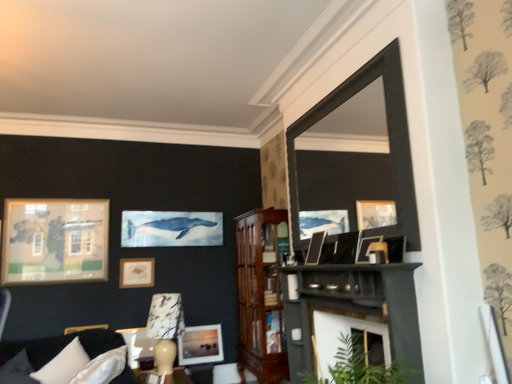
Locate an element on the screen. The height and width of the screenshot is (384, 512). matte black picture frame at center, positioned as the second picture frame in right-to-left order is located at coordinates (340, 249).

Locate an element on the screen. matte gold picture frame at upper left, which is the 1th picture frame from back to front is located at coordinates (136, 272).

What do you see at coordinates (136, 272) in the screenshot? This screenshot has height=384, width=512. I see `matte gold picture frame at upper left, the 5th picture frame viewed from the right` at bounding box center [136, 272].

Image resolution: width=512 pixels, height=384 pixels. What do you see at coordinates (61, 345) in the screenshot? I see `dark gray fabric couch at lower left` at bounding box center [61, 345].

What do you see at coordinates (366, 248) in the screenshot?
I see `matte black picture frame at upper center, the 1th picture frame from the right` at bounding box center [366, 248].

You are a GUI agent. You are given a task and a screenshot of the screen. Output one action in this format:
    pyautogui.click(x=<x>, y=<y>)
    Task: Click on the matte glass picture frame at center, the second picture frame positioned from the left
    This screenshot has width=512, height=384.
    Given the screenshot: What is the action you would take?
    pyautogui.click(x=200, y=345)

Image resolution: width=512 pixels, height=384 pixels. I want to click on smooth dark wood shelf at center, so click(x=353, y=307).

Based on the photo, between white fabric pillow at lower left and smooth dark wood shelf at center, which one has less height?

Standing shorter between the two is white fabric pillow at lower left.

Is white fabric pillow at lower left behind smooth dark wood shelf at center?

Yes, white fabric pillow at lower left is further from the viewer.

Which is correct: white fabric pillow at lower left is inside smooth dark wood shelf at center, or outside of it?

The correct answer is: outside.

Considering the positions of points (312, 262) and (179, 306), is point (312, 262) closer to camera compared to point (179, 306)?

Yes, it is.

Considering the positions of objects matte black picture frame at center, which appears as the third picture frame when viewed from the back, and white marble lamp at lower center in the image provided, who is more to the left, matte black picture frame at center, which appears as the third picture frame when viewed from the back, or white marble lamp at lower center?

Positioned to the left is white marble lamp at lower center.

From their relative heights in the image, would you say matte black picture frame at center, the third picture frame positioned from the right, is taller or shorter than white marble lamp at lower center?

Clearly, matte black picture frame at center, the third picture frame positioned from the right, is shorter compared to white marble lamp at lower center.

Consider the image. From the image's perspective, would you say white marble lamp at lower center is positioned over matte black picture frame at center, the third picture frame positioned from the right?

No.

Can you see white marble lamp at lower center touching matte black picture frame at center, the third picture frame from the left?

No.

Does white marble lamp at lower center turn towards matte black picture frame at center, which is counted as the 3th picture frame, starting from the front?

No, white marble lamp at lower center is not oriented towards matte black picture frame at center, which is counted as the 3th picture frame, starting from the front.

Measure the distance from matte black picture frame at center, which is the 4th picture frame from left to right, to smooth dark wood shelf at center.

A distance of 12.68 inches exists between matte black picture frame at center, which is the 4th picture frame from left to right, and smooth dark wood shelf at center.

Considering the relative sizes of matte black picture frame at center, the 2th picture frame from the top, and smooth dark wood shelf at center in the image provided, is matte black picture frame at center, the 2th picture frame from the top, thinner than smooth dark wood shelf at center?

Correct, the width of matte black picture frame at center, the 2th picture frame from the top, is less than that of smooth dark wood shelf at center.

This screenshot has width=512, height=384. Find the location of `shelf beneath the matte black picture frame at center, positioned as the second picture frame in right-to-left order (from a real-world perspective)`. shelf beneath the matte black picture frame at center, positioned as the second picture frame in right-to-left order (from a real-world perspective) is located at coordinates (353, 307).

The height and width of the screenshot is (384, 512). What are the coordinates of `the 4th picture frame counting from the right side of the white marble lamp at lower center` in the screenshot? It's located at (366, 248).

Consider the image. From the image's perspective, is matte black picture frame at upper center, the 1th picture frame from the right, located beneath white marble lamp at lower center?

No.

Consider the image. From a real-world perspective, relative to white marble lamp at lower center, is matte black picture frame at upper center, the 5th picture frame in the left-to-right sequence, vertically above or below?

In terms of real-world spatial position, matte black picture frame at upper center, the 5th picture frame in the left-to-right sequence, is above white marble lamp at lower center.

Is matte black picture frame at center, which is the 4th picture frame from left to right, inside the boundaries of white fabric pillow at lower left, or outside?

matte black picture frame at center, which is the 4th picture frame from left to right, is not inside white fabric pillow at lower left, it's outside.

In the scene shown: Can you confirm if matte black picture frame at center, positioned as the second picture frame in front-to-back order, is shorter than white fabric pillow at lower left?

Yes.

Which object is thinner, matte black picture frame at center, which is the 4th picture frame from left to right, or white fabric pillow at lower left?

matte black picture frame at center, which is the 4th picture frame from left to right.

Where is `the 1st picture frame behind the white fabric pillow at lower left`? Image resolution: width=512 pixels, height=384 pixels. the 1st picture frame behind the white fabric pillow at lower left is located at coordinates (340, 249).

In the scene shown: From the image's perspective, who appears lower, mahogany wood cabinet at center or smooth dark wood shelf at center?

From the image's view, mahogany wood cabinet at center is below.

Does mahogany wood cabinet at center have a lesser width compared to smooth dark wood shelf at center?

Incorrect, the width of mahogany wood cabinet at center is not less than that of smooth dark wood shelf at center.

Are mahogany wood cabinet at center and smooth dark wood shelf at center located far from each other?

That's not correct — mahogany wood cabinet at center is a little close to smooth dark wood shelf at center.

In the image, is mahogany wood cabinet at center positioned in front of or behind smooth dark wood shelf at center?

mahogany wood cabinet at center is behind smooth dark wood shelf at center.

Where is `shelf in front of the white fabric pillow at lower left`? Image resolution: width=512 pixels, height=384 pixels. shelf in front of the white fabric pillow at lower left is located at coordinates (353, 307).

Identify the location of picture frame that is the 2nd one when counting rightward from the white marble lamp at lower center. (315, 248).

When comparing their distances from matte black picture frame at upper center, the 5th picture frame in the left-to-right sequence, does white fabric pillow at lower left or smooth dark wood shelf at center seem closer?

Based on the image, smooth dark wood shelf at center appears to be nearer to matte black picture frame at upper center, the 5th picture frame in the left-to-right sequence.

Based on their spatial positions, is matte black picture frame at upper center, the 1th picture frame from the right, or matte black picture frame at center, which is counted as the fourth picture frame, starting from the bottom, closer to matte glass picture frame at center, which is the 2th picture frame from back to front?

The object closer to matte glass picture frame at center, which is the 2th picture frame from back to front, is matte black picture frame at center, which is counted as the fourth picture frame, starting from the bottom.

Which object lies nearer to the anchor point mahogany wood cabinet at center, matte glass picture frame at center, which is counted as the fourth picture frame, starting from the front, or matte black picture frame at center, which is counted as the fourth picture frame, starting from the bottom?

matte glass picture frame at center, which is counted as the fourth picture frame, starting from the front.

Based on their spatial positions, is white marble lamp at lower center or matte black picture frame at center, the third picture frame positioned from the right, further from matte black picture frame at upper center, the 5th picture frame in the left-to-right sequence?

white marble lamp at lower center.

Estimate the real-world distances between objects in this image. Which object is closer to dark gray fabric couch at lower left, matte black picture frame at upper center, the 1th picture frame from the right, or matte glass picture frame at center, which is counted as the fourth picture frame, starting from the front?

The object closer to dark gray fabric couch at lower left is matte glass picture frame at center, which is counted as the fourth picture frame, starting from the front.

Which object lies nearer to the anchor point matte black picture frame at upper center, positioned as the 1th picture frame in front-to-back order, white marble lamp at lower center or mahogany wood cabinet at center?

mahogany wood cabinet at center is positioned closer to the anchor matte black picture frame at upper center, positioned as the 1th picture frame in front-to-back order.

Estimate the real-world distances between objects in this image. Which object is further from matte black picture frame at center, which is the 4th picture frame from left to right, mahogany wood cabinet at center or dark gray fabric couch at lower left?

dark gray fabric couch at lower left.

Looking at the image, which one is located further to matte black picture frame at center, arranged as the 4th picture frame when viewed from the back, white fabric pillow at lower left or dark gray fabric couch at lower left?

The object further to matte black picture frame at center, arranged as the 4th picture frame when viewed from the back, is white fabric pillow at lower left.

At what (x,y) coordinates should I click in order to perform the action: click on lamp located between white fabric pillow at lower left and matte black picture frame at center, the third picture frame positioned from the right, in the left-right direction. Please return your answer as a coordinate pair (x, y). Image resolution: width=512 pixels, height=384 pixels. Looking at the image, I should click on (165, 328).

Find the location of `couch between matte black picture frame at upper center, positioned as the 1th picture frame in front-to-back order, and matte gold picture frame at upper left, which is counted as the fifth picture frame, starting from the front, in the front-back direction`. couch between matte black picture frame at upper center, positioned as the 1th picture frame in front-to-back order, and matte gold picture frame at upper left, which is counted as the fifth picture frame, starting from the front, in the front-back direction is located at coordinates (61, 345).

At what (x,y) coordinates should I click in order to perform the action: click on lamp between white fabric pillow at lower left and smooth dark wood shelf at center from left to right. Please return your answer as a coordinate pair (x, y). This screenshot has height=384, width=512. Looking at the image, I should click on (165, 328).

Locate an element on the screen. couch between smooth dark wood shelf at center and mahogany wood cabinet at center from front to back is located at coordinates (61, 345).